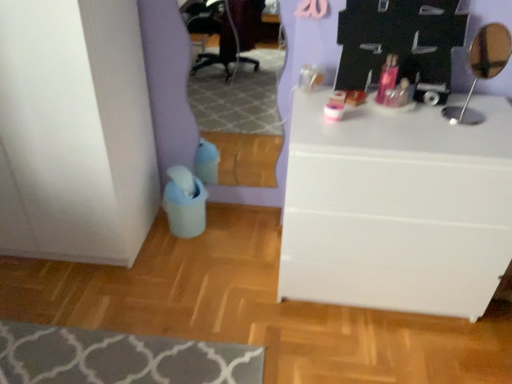
Question: Is gray textured rug at lower left with white matte chest of drawers at center?

Choices:
 (A) yes
 (B) no

Answer: (B)

Question: Does gray textured rug at lower left appear on the right side of white matte chest of drawers at center?

Choices:
 (A) no
 (B) yes

Answer: (A)

Question: Does gray textured rug at lower left have a lesser width compared to white matte chest of drawers at center?

Choices:
 (A) yes
 (B) no

Answer: (B)

Question: Considering the relative sizes of gray textured rug at lower left and white matte chest of drawers at center in the image provided, is gray textured rug at lower left shorter than white matte chest of drawers at center?

Choices:
 (A) no
 (B) yes

Answer: (B)

Question: Considering the relative positions of gray textured rug at lower left and white matte chest of drawers at center in the image provided, is gray textured rug at lower left to the left of white matte chest of drawers at center from the viewer's perspective?

Choices:
 (A) yes
 (B) no

Answer: (A)

Question: Based on their positions, is gray textured rug at lower left located to the left or right of metallic silver mirror at upper right?

Choices:
 (A) right
 (B) left

Answer: (B)

Question: From the image's perspective, is gray textured rug at lower left located above or below metallic silver mirror at upper right?

Choices:
 (A) above
 (B) below

Answer: (B)

Question: From their relative heights in the image, would you say gray textured rug at lower left is taller or shorter than metallic silver mirror at upper right?

Choices:
 (A) tall
 (B) short

Answer: (B)

Question: Is gray textured rug at lower left inside or outside of metallic silver mirror at upper right?

Choices:
 (A) outside
 (B) inside

Answer: (A)

Question: Is white matte chest of drawers at center bigger or smaller than gray textured rug at lower left?

Choices:
 (A) small
 (B) big

Answer: (B)

Question: In terms of width, does white matte chest of drawers at center look wider or thinner when compared to gray textured rug at lower left?

Choices:
 (A) thin
 (B) wide

Answer: (A)

Question: In terms of height, does white matte chest of drawers at center look taller or shorter compared to gray textured rug at lower left?

Choices:
 (A) tall
 (B) short

Answer: (A)

Question: From a real-world perspective, is white matte chest of drawers at center physically located above or below gray textured rug at lower left?

Choices:
 (A) below
 (B) above

Answer: (B)

Question: Based on their positions, is metallic silver mirror at upper right located to the left or right of gray textured rug at lower left?

Choices:
 (A) right
 (B) left

Answer: (A)

Question: Is metallic silver mirror at upper right wider or thinner than gray textured rug at lower left?

Choices:
 (A) thin
 (B) wide

Answer: (A)